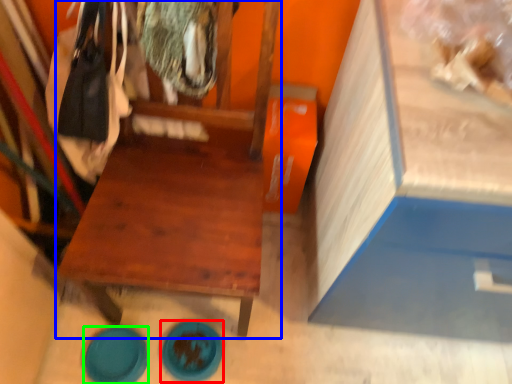
Question: Based on their relative distances, which object is nearer to plate (highlighted by a red box)? Choose from furniture (highlighted by a blue box) and plate (highlighted by a green box).

Choices:
 (A) furniture
 (B) plate

Answer: (B)